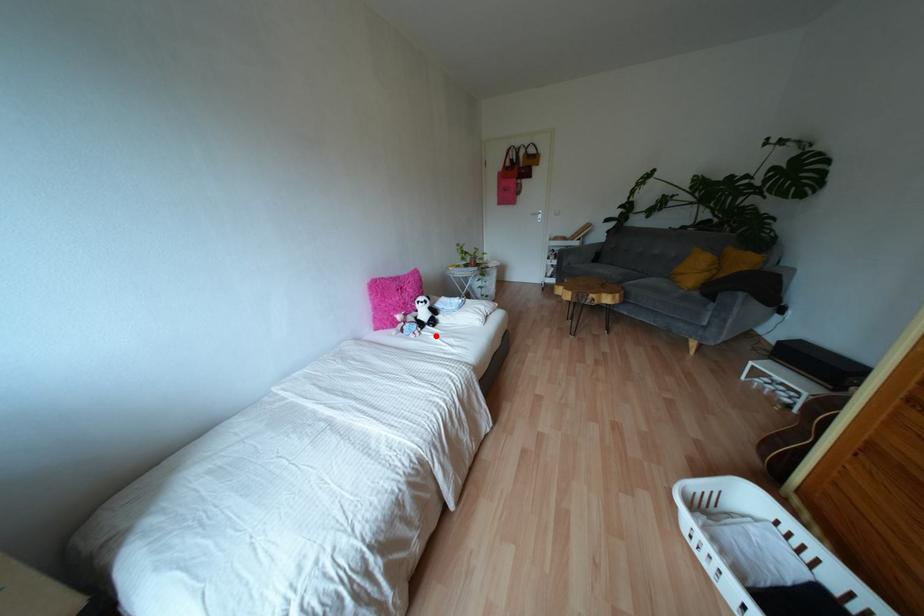
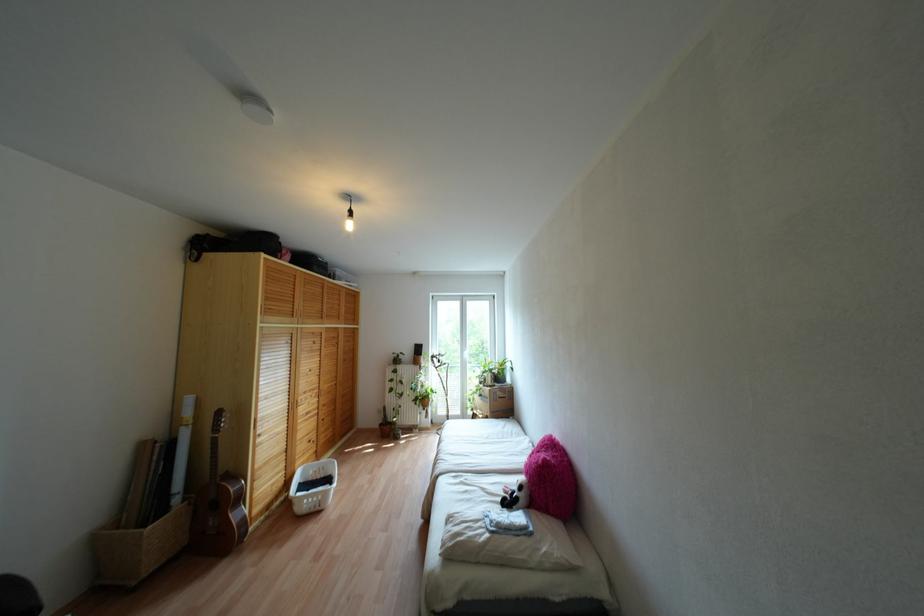
In the second image, find the point that corresponds to the highlighted location in the first image.

(482, 488)